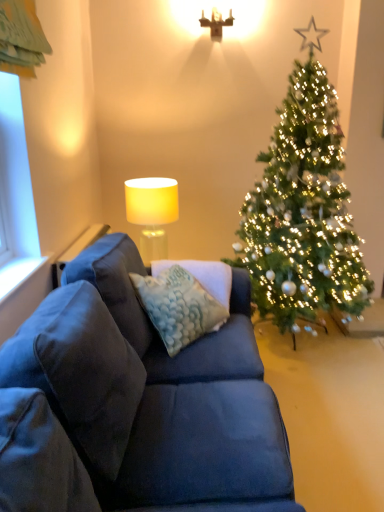
Find the location of a particular element. matte white lampshade at upper center is located at coordinates (216, 23).

Based on the photo, measure the distance between point (173, 188) and camera.

The distance of point (173, 188) from camera is 2.62 meters.

What do you see at coordinates (178, 306) in the screenshot? I see `textured blue pillow at center` at bounding box center [178, 306].

The height and width of the screenshot is (512, 384). Identify the location of white painted wood at left. pos(18,273).

I want to click on matte white lampshade at upper center, so click(x=216, y=23).

Is point (213, 13) behind point (134, 285)?

That is True.

Based on the photo, does matte white lampshade at upper center have a greater width compared to textured blue pillow at center?

In fact, matte white lampshade at upper center might be narrower than textured blue pillow at center.

From the image's perspective, which one is positioned higher, matte white lampshade at upper center or textured blue pillow at center?

matte white lampshade at upper center.

Which object is further away from the camera taking this photo, matte white lampshade at upper center or textured blue pillow at center?

matte white lampshade at upper center is behind.

Is white painted wood at left wider or thinner than matte white lampshade at upper center?

Considering their sizes, white painted wood at left looks slimmer than matte white lampshade at upper center.

Could you tell me if white painted wood at left is facing matte white lampshade at upper center?

No, white painted wood at left is not turned towards matte white lampshade at upper center.

From the image's perspective, which is above, green textured christmas tree at right or white painted wood at left?

From the image's view, green textured christmas tree at right is above.

Is green textured christmas tree at right turned away from white painted wood at left?

green textured christmas tree at right is not turned away from white painted wood at left.

Are green textured christmas tree at right and white painted wood at left beside each other?

They are not placed beside each other.

From a real-world perspective, is white painted wood at left physically below white fabric lampshade at upper center?

Actually, white painted wood at left is physically above white fabric lampshade at upper center in the real world.

Based on the photo, is the surface of white painted wood at left in direct contact with white fabric lampshade at upper center?

No, white painted wood at left is not next to white fabric lampshade at upper center.

Is white fabric lampshade at upper center at the back of white painted wood at left?

No, white fabric lampshade at upper center is not at the back of white painted wood at left.

Is matte white lampshade at upper center to the left or to the right of green textured christmas tree at right in the image?

matte white lampshade at upper center is positioned on green textured christmas tree at right's left side.

Identify the location of lamp that appears behind the green textured christmas tree at right. The image size is (384, 512). (216, 23).

Could green textured christmas tree at right be considered to be inside matte white lampshade at upper center?

No, green textured christmas tree at right is located outside of matte white lampshade at upper center.

From a real-world perspective, which object rests below the other?

green textured christmas tree at right, from a real-world perspective.

Is white painted wood at left wider than green textured christmas tree at right?

No, white painted wood at left is not wider than green textured christmas tree at right.

Which object is further away from the camera taking this photo, white painted wood at left or green textured christmas tree at right?

green textured christmas tree at right is further away from the camera.

Does white painted wood at left turn towards green textured christmas tree at right?

No, white painted wood at left is not oriented towards green textured christmas tree at right.

The height and width of the screenshot is (512, 384). I want to click on christmas tree behind the white painted wood at left, so click(x=303, y=209).

Between white fabric lampshade at upper center and textured blue pillow at center, which one is positioned in front?

textured blue pillow at center is in front.

From the image's perspective, who appears lower, white fabric lampshade at upper center or textured blue pillow at center?

textured blue pillow at center.

Which of these two, white fabric lampshade at upper center or textured blue pillow at center, is smaller?

textured blue pillow at center is smaller.

Is white fabric lampshade at upper center beside textured blue pillow at center?

No, white fabric lampshade at upper center is not beside textured blue pillow at center.

Identify the location of lamp lying above the textured blue pillow at center (from the image's perspective). (216, 23).

Locate an element on the screen. window sill in front of the matte white lampshade at upper center is located at coordinates (18, 273).

Looking at the image, which one is located closer to white painted wood at left, white fabric lampshade at upper center or green textured christmas tree at right?

The object closer to white painted wood at left is white fabric lampshade at upper center.

Which object lies nearer to the anchor point white fabric lampshade at upper center, white painted wood at left or matte white lampshade at upper center?

white painted wood at left is closer to white fabric lampshade at upper center.

Which object lies nearer to the anchor point white painted wood at left, green textured christmas tree at right or matte white lampshade at upper center?

green textured christmas tree at right.

Estimate the real-world distances between objects in this image. Which object is closer to matte white lampshade at upper center, white fabric lampshade at upper center or textured blue pillow at center?

The object closer to matte white lampshade at upper center is white fabric lampshade at upper center.

When comparing their distances from textured blue pillow at center, does matte white lampshade at upper center or green textured christmas tree at right seem closer?

The object closer to textured blue pillow at center is green textured christmas tree at right.

Looking at this image, looking at the image, which one is located further to white fabric lampshade at upper center, white painted wood at left or green textured christmas tree at right?

white painted wood at left is further to white fabric lampshade at upper center.

From the picture: Looking at the image, which one is located closer to textured blue pillow at center, green textured christmas tree at right or white painted wood at left?

Based on the image, white painted wood at left appears to be nearer to textured blue pillow at center.

Which object lies nearer to the anchor point matte white lampshade at upper center, white fabric lampshade at upper center or green textured christmas tree at right?

white fabric lampshade at upper center.

Where is `pillow situated between white painted wood at left and green textured christmas tree at right from left to right`? The width and height of the screenshot is (384, 512). pillow situated between white painted wood at left and green textured christmas tree at right from left to right is located at coordinates (178, 306).

Locate an element on the screen. The image size is (384, 512). window sill between matte white lampshade at upper center and textured blue pillow at center vertically is located at coordinates (18, 273).

Locate an element on the screen. This screenshot has width=384, height=512. pillow between white fabric lampshade at upper center and green textured christmas tree at right in the horizontal direction is located at coordinates click(178, 306).

This screenshot has height=512, width=384. In order to click on christmas tree between matte white lampshade at upper center and textured blue pillow at center vertically in this screenshot , I will do `click(303, 209)`.